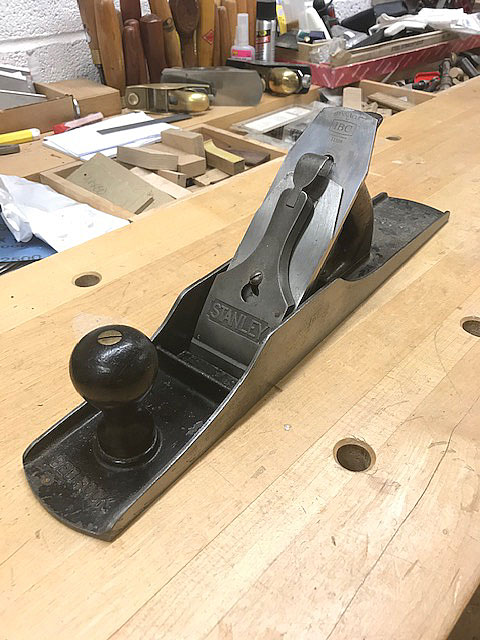
The width and height of the screenshot is (480, 640). What are the coordinates of `wooden blocks` in the screenshot? It's located at (139, 157), (121, 185), (195, 162), (187, 136), (227, 161), (179, 187), (155, 196), (203, 178), (174, 176).